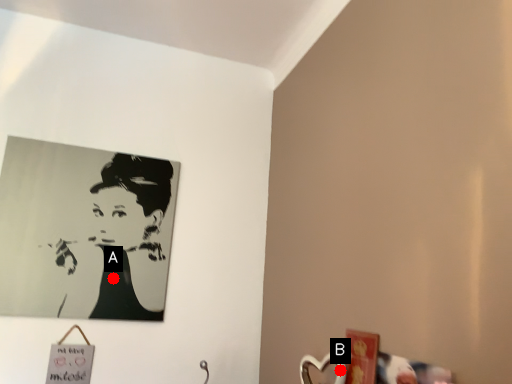
Question: Two points are circled on the image, labeled by A and B beside each circle. Which point is closer to the camera?

Choices:
 (A) A is closer
 (B) B is closer

Answer: (B)